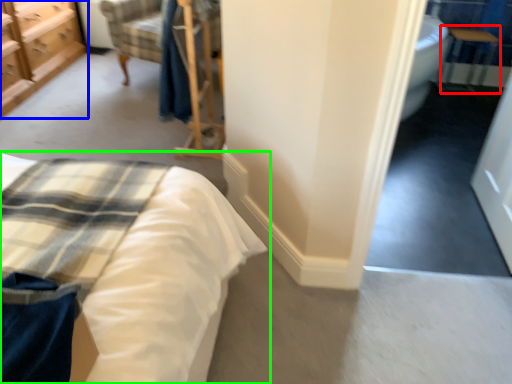
Question: Based on their relative distances, which object is nearer to table (highlighted by a red box)? Choose from chest of drawers (highlighted by a blue box) and bed (highlighted by a green box).

Choices:
 (A) chest of drawers
 (B) bed

Answer: (B)